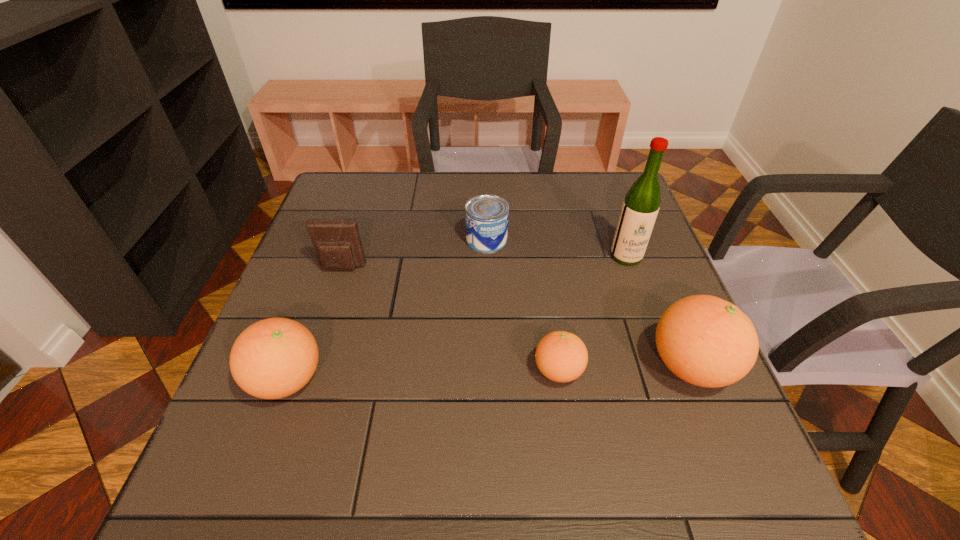
You are a GUI agent. You are given a task and a screenshot of the screen. Output one action in this format:
    pyautogui.click(x=<x>, y=<y>)
    Task: Click on the vacant area situated 0.380m on the front label of the fourth object from right to left
    
    Given the screenshot: What is the action you would take?
    pyautogui.click(x=490, y=381)

Identify the location of vacant area situated 0.290m with an open flap on the pouch. The height and width of the screenshot is (540, 960). (307, 375).

Find the location of a particular element. This screenshot has height=540, width=960. vacant space located 0.200m on the label of the tallest object is located at coordinates (653, 329).

At what (x,y) coordinates should I click in order to perform the action: click on orange that is at the left edge. Please return your answer as a coordinate pair (x, y). Looking at the image, I should click on (273, 358).

Image resolution: width=960 pixels, height=540 pixels. What are the coordinates of `pouch that is positioned at the left edge` in the screenshot? It's located at (337, 244).

Locate an element on the screen. Image resolution: width=960 pixels, height=540 pixels. orange situated at the right edge is located at coordinates (706, 341).

Find the location of a particular element. This screenshot has height=540, width=960. liquor that is at the right edge is located at coordinates (640, 208).

Where is `object located at the near left corner`? Image resolution: width=960 pixels, height=540 pixels. object located at the near left corner is located at coordinates (273, 358).

The height and width of the screenshot is (540, 960). I want to click on object that is at the near right corner, so click(x=706, y=341).

Locate an element on the screen. The height and width of the screenshot is (540, 960). vacant region at the far edge of the desktop is located at coordinates (564, 212).